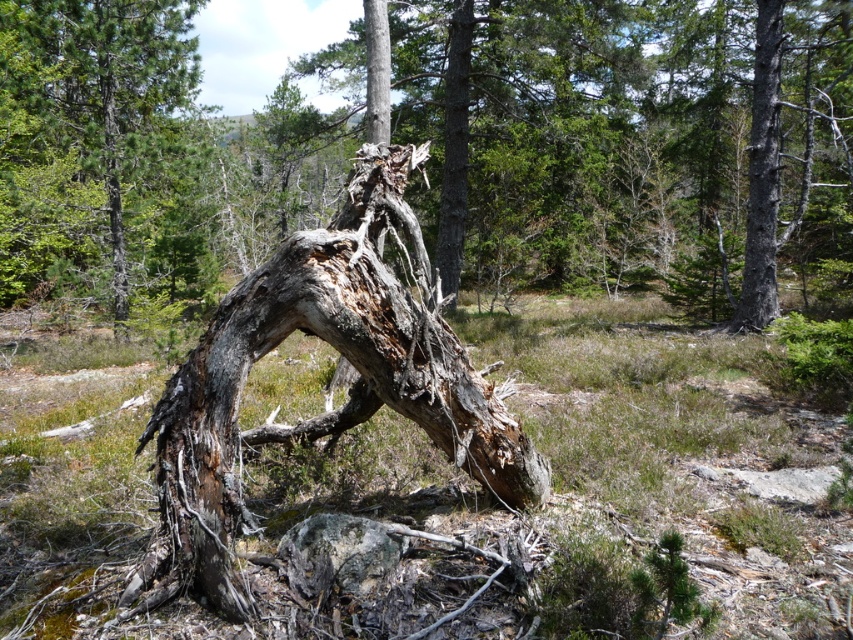
You are a hiker trying to navigate through the forest. You see the gray bark tree at center and the smooth gray bark at upper right. Which object is closer to you?

The gray bark tree at center is closer to you because the smooth gray bark at upper right is behind it.

You are a hiker who has stumbled upon this forest scene. You notice the gray bark tree at center and the smooth gray bark at upper right. Which of these two objects is located higher up in the image?

The gray bark tree at center is positioned over smooth gray bark at upper right, so it is higher up in the image.